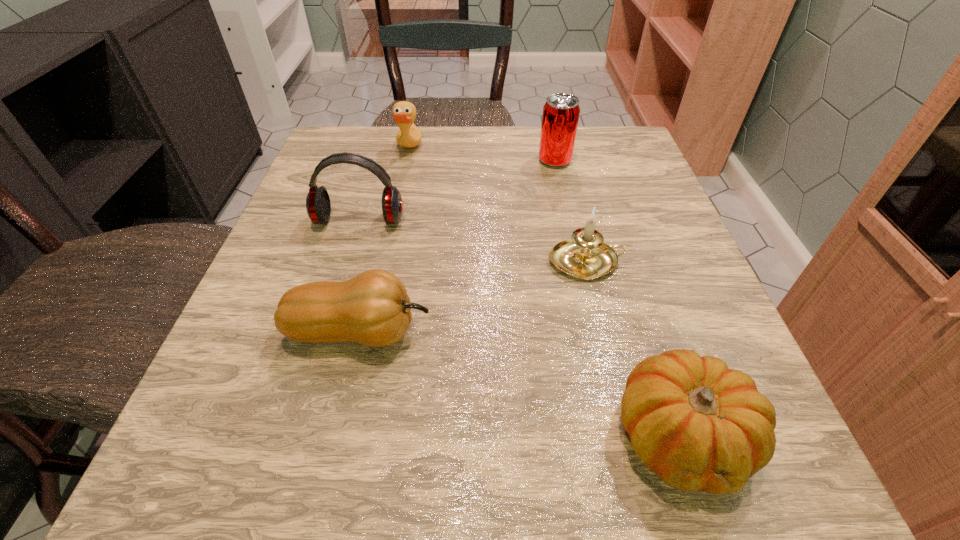
I want to click on vacant point that satisfies the following two spatial constraints: 1. on the beak of the soda can; 2. on the right side of the duck, so click(406, 161).

In order to click on vacant point that satisfies the following two spatial constraints: 1. on the handle side of the nearer gourd; 2. on the right side of the fourth farthest object in this screenshot , I will do `click(631, 436)`.

I want to click on vacant position in the image that satisfies the following two spatial constraints: 1. on the stem side of the farther gourd; 2. on the left side of the right gourd, so click(x=335, y=436).

Image resolution: width=960 pixels, height=540 pixels. In order to click on vacant point that satisfies the following two spatial constraints: 1. on the handle side of the fourth farthest object; 2. on the right side of the nearest object in this screenshot , I will do `click(631, 436)`.

Where is `free region that satisfies the following two spatial constraints: 1. on the back side of the nearer gourd; 2. on the beak of the duck`? The height and width of the screenshot is (540, 960). free region that satisfies the following two spatial constraints: 1. on the back side of the nearer gourd; 2. on the beak of the duck is located at coordinates (588, 150).

Where is `free space that satisfies the following two spatial constraints: 1. on the ear cups of the earphone; 2. on the right side of the nearest object`? Image resolution: width=960 pixels, height=540 pixels. free space that satisfies the following two spatial constraints: 1. on the ear cups of the earphone; 2. on the right side of the nearest object is located at coordinates (295, 436).